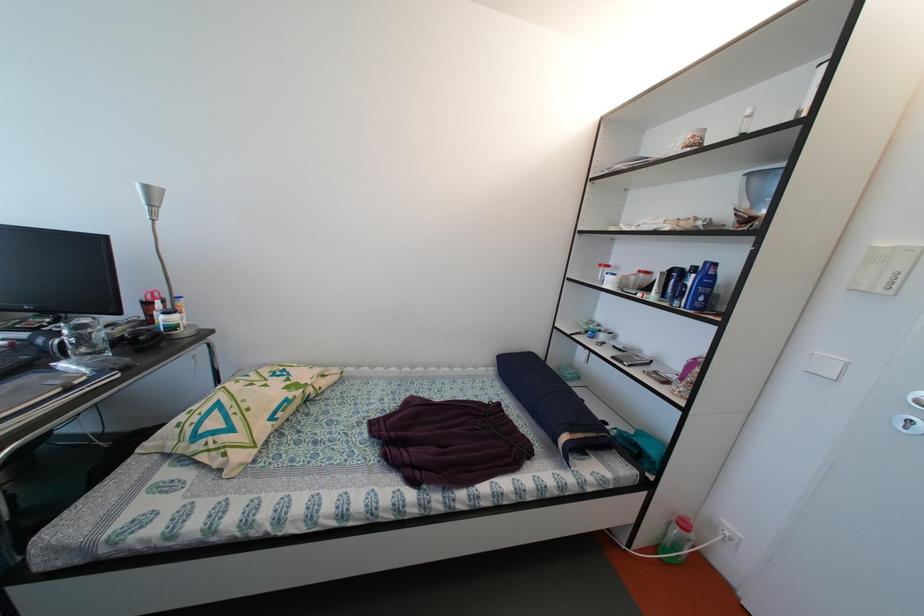
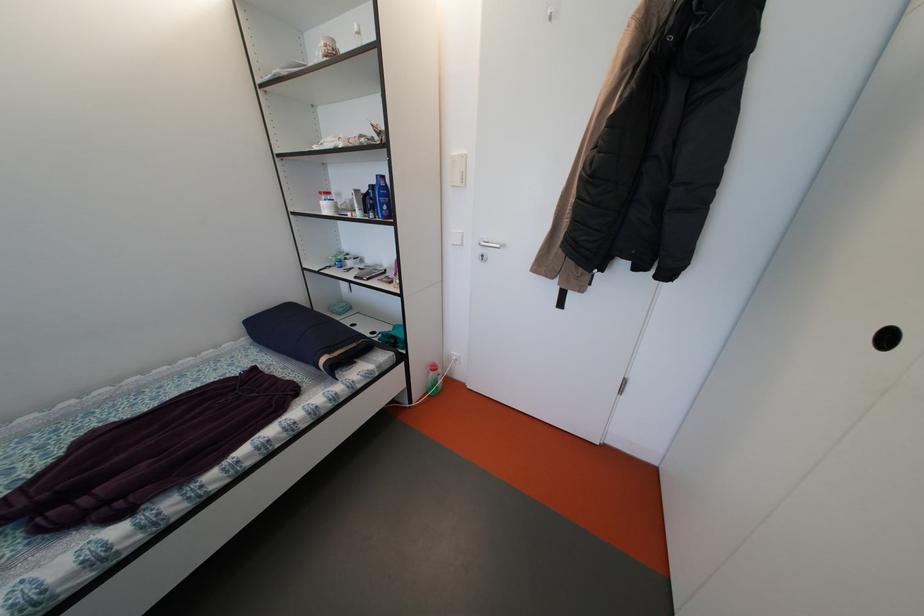
The point at [572,443] is marked in the first image. Where is the corresponding point in the second image?

(331, 365)